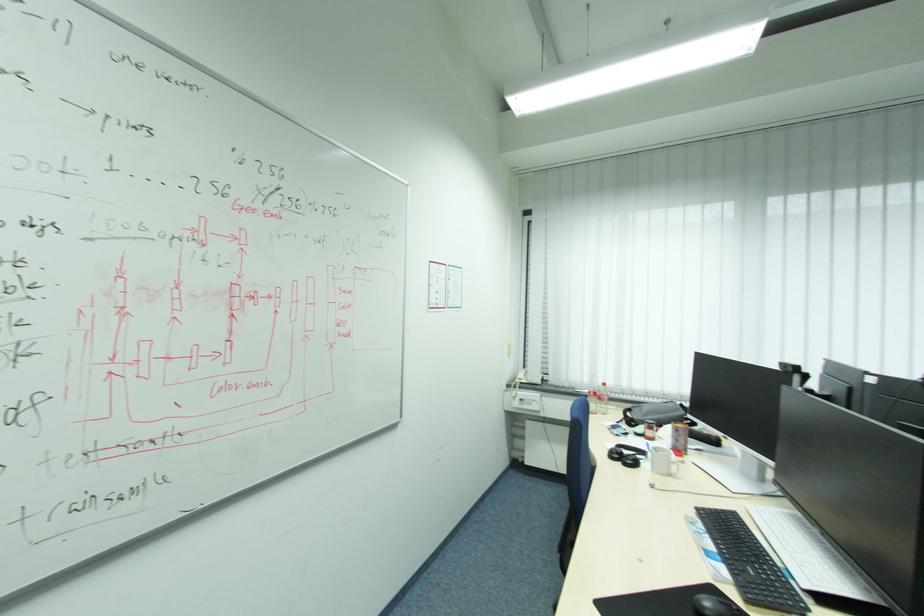
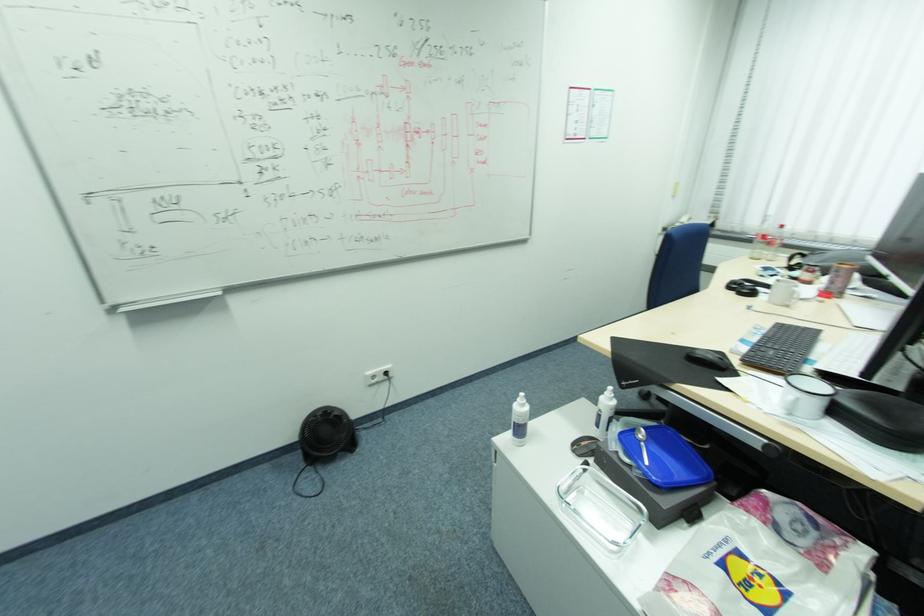
Locate, in the second image, the point that corresponds to point 676,475 in the first image.

(792, 307)